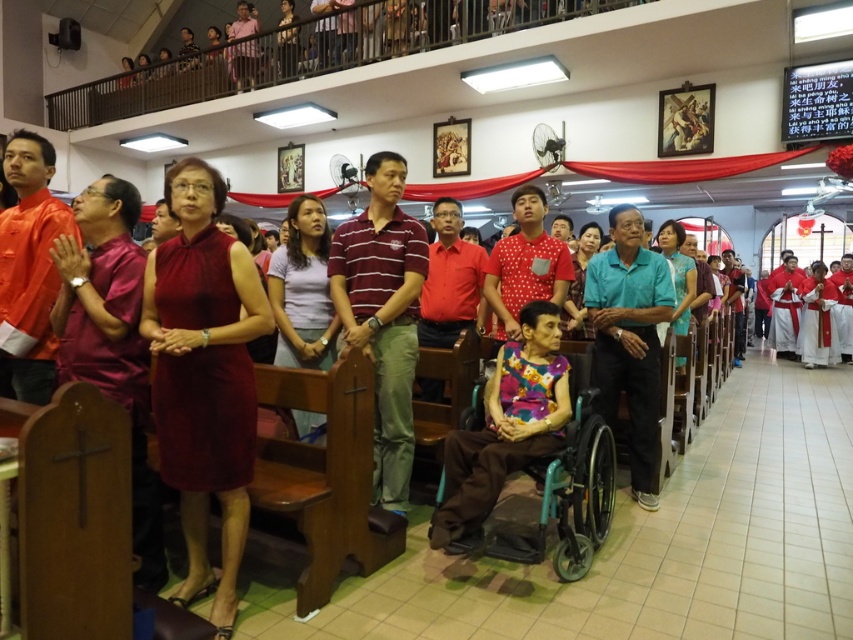
Is maroon striped polo shirt at center further to camera compared to teal plastic wheelchair at center?

That is True.

Who is more distant from viewer, (349,278) or (543,509)?

Positioned behind is point (349,278).

Locate an element on the screen. maroon striped polo shirt at center is located at coordinates (383, 314).

I want to click on maroon striped polo shirt at center, so click(383, 314).

Can you confirm if teal fabric shirt at center is thinner than teal plastic wheelchair at center?

Indeed, teal fabric shirt at center has a lesser width compared to teal plastic wheelchair at center.

Which of these two, teal fabric shirt at center or teal plastic wheelchair at center, stands taller?

teal fabric shirt at center is taller.

Is point (642, 369) positioned after point (576, 560)?

Yes.

Where is `teal fabric shirt at center`? This screenshot has height=640, width=853. teal fabric shirt at center is located at coordinates (630, 339).

Does maroon satin dress at center appear on the left side of maroon striped polo shirt at center?

Yes, maroon satin dress at center is to the left of maroon striped polo shirt at center.

Is point (271, 317) less distant than point (366, 278)?

Yes, it is in front of point (366, 278).

At what (x,y) coordinates should I click in order to perform the action: click on maroon satin dress at center. Please return your answer as a coordinate pair (x, y). This screenshot has height=640, width=853. Looking at the image, I should click on (204, 376).